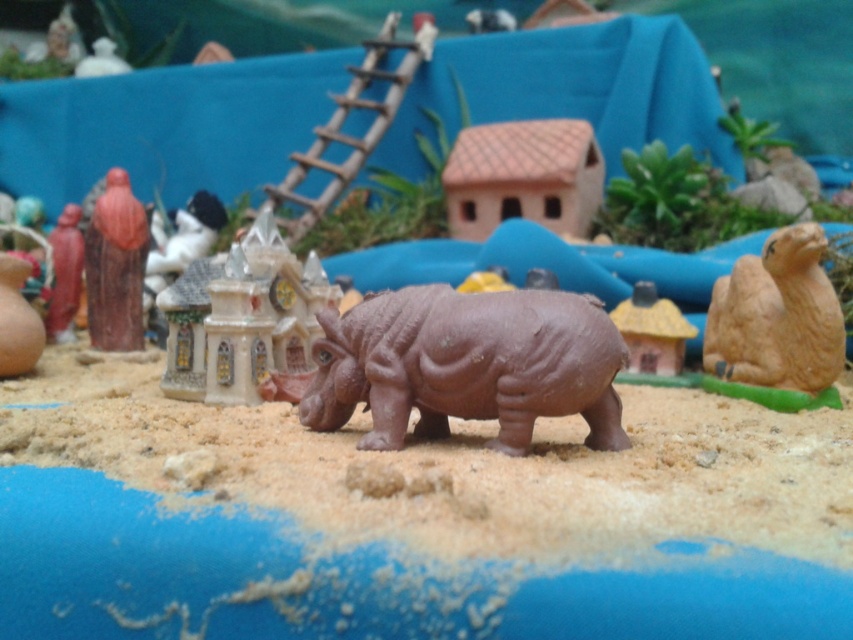
Question: Considering the relative positions of brown matte rhinoceros at center and brown matte house at center in the image provided, where is brown matte rhinoceros at center located with respect to brown matte house at center?

Choices:
 (A) right
 (B) left

Answer: (B)

Question: Which of the following is the closest to the observer?

Choices:
 (A) matte plastic castle at center
 (B) brown matte rhinoceros at center

Answer: (B)

Question: Can you confirm if brown matte rhinoceros at center is positioned to the right of matte brown figurine at left?

Choices:
 (A) yes
 (B) no

Answer: (A)

Question: Which object is farther from the camera taking this photo?

Choices:
 (A) brown matte rhinoceros at center
 (B) matte plastic castle at center
 (C) brown matte camel at right

Answer: (C)

Question: Which object is closer to the camera taking this photo?

Choices:
 (A) matte brown figurine at left
 (B) wooden statue at left
 (C) brown matte house at center

Answer: (C)

Question: Can you confirm if wooden statue at left is bigger than brown matte house at center?

Choices:
 (A) no
 (B) yes

Answer: (A)